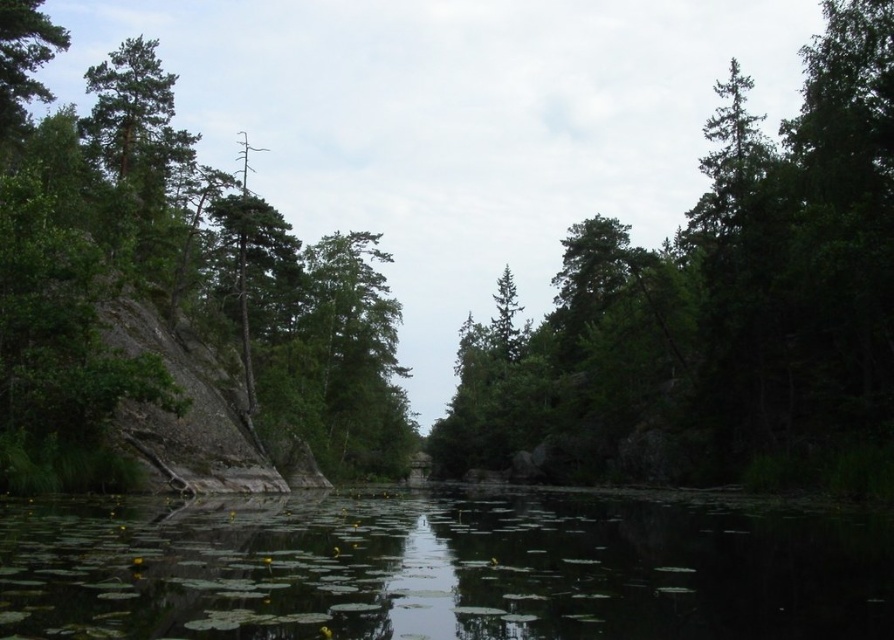
Question: Observing the image, what is the correct spatial positioning of green leafy tree at center in reference to green leafy river at center?

Choices:
 (A) above
 (B) below

Answer: (A)

Question: Can you confirm if green leafy river at center is thinner than green rough rock at left?

Choices:
 (A) yes
 (B) no

Answer: (B)

Question: Which point is farther from the camera taking this photo?

Choices:
 (A) (203, 180)
 (B) (555, 307)
 (C) (469, 611)

Answer: (B)

Question: Which point appears closest to the camera in this image?

Choices:
 (A) (102, 92)
 (B) (336, 609)

Answer: (B)

Question: Which object is the farthest from the green leafy tree at center?

Choices:
 (A) green rough rock at left
 (B) green leafy river at center

Answer: (B)

Question: Does green leafy tree at center have a lesser width compared to green rough rock at left?

Choices:
 (A) yes
 (B) no

Answer: (B)